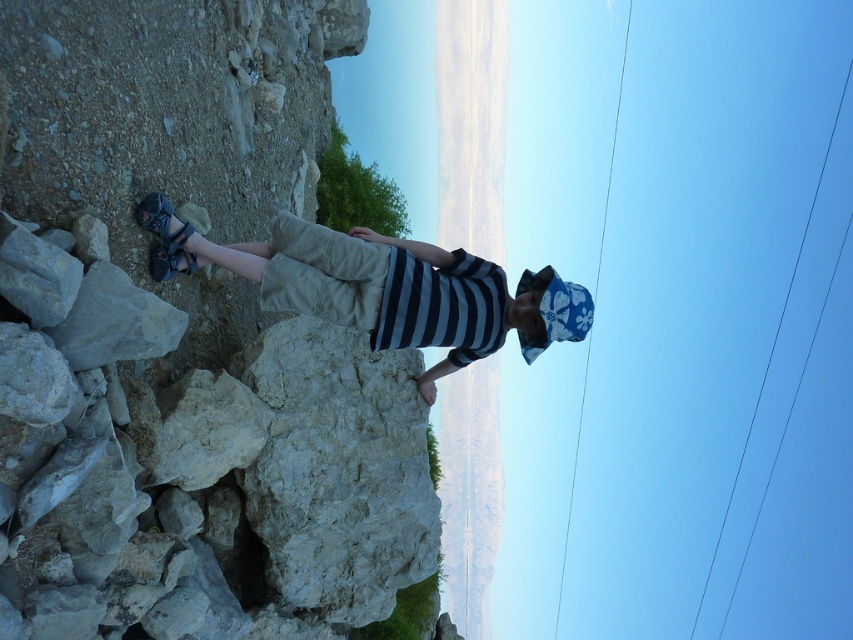
Question: Can you confirm if rough stone cliff at left is positioned to the right of khaki cotton shorts at center?

Choices:
 (A) no
 (B) yes

Answer: (A)

Question: Which object is farther from the camera taking this photo?

Choices:
 (A) khaki cotton shorts at center
 (B) rough stone cliff at left

Answer: (A)

Question: Is rough stone cliff at left above khaki cotton shorts at center?

Choices:
 (A) no
 (B) yes

Answer: (A)

Question: Does rough stone cliff at left have a smaller size compared to khaki cotton shorts at center?

Choices:
 (A) yes
 (B) no

Answer: (B)